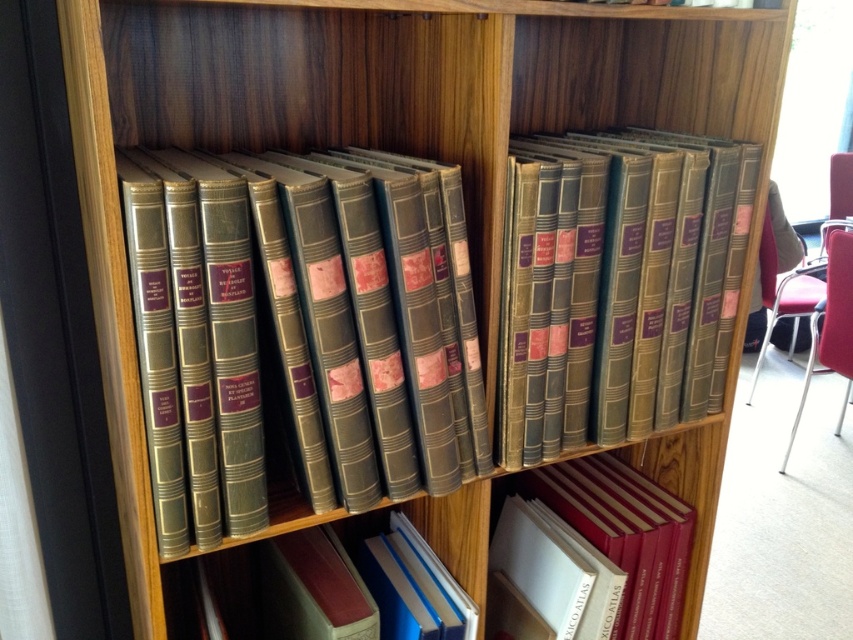
Question: Which object appears farthest from the camera in this image?

Choices:
 (A) green leather-bound books at center
 (B) hardcover book at center
 (C) red leather book at lower right

Answer: (C)

Question: Does matte leather book at center appear on the right side of red leather book at lower right?

Choices:
 (A) no
 (B) yes

Answer: (A)

Question: Which object is closer to the camera taking this photo?

Choices:
 (A) hardcover book at center
 (B) red leather book at lower right
 (C) green leather-bound books at center

Answer: (C)

Question: Which object is farther from the camera taking this photo?

Choices:
 (A) matte leather book at center
 (B) green leather-bound books at center

Answer: (A)

Question: Is matte leather book at center bigger than red leather book at lower right?

Choices:
 (A) yes
 (B) no

Answer: (A)

Question: Can you confirm if green leather-bound books at center is positioned to the right of red leather book at lower right?

Choices:
 (A) yes
 (B) no

Answer: (B)